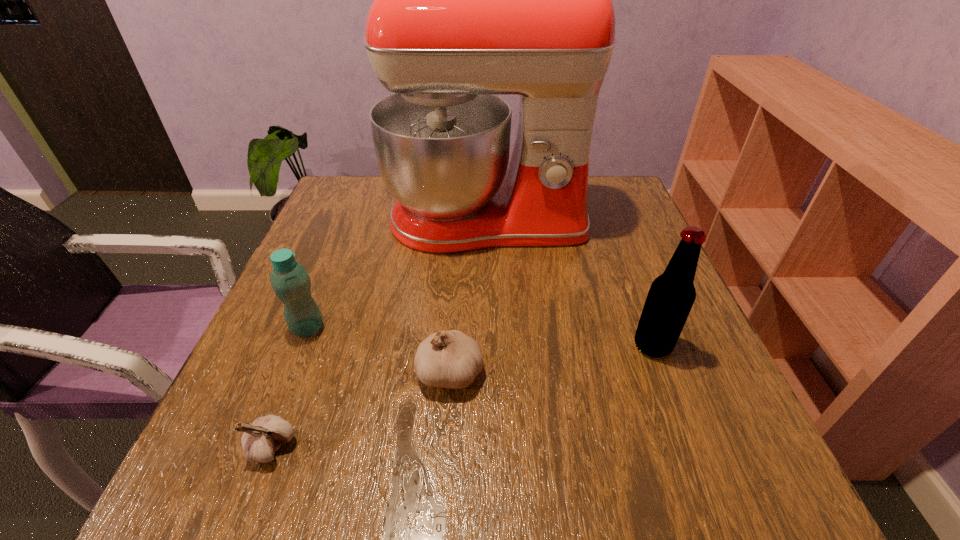
This screenshot has width=960, height=540. Find the location of `vacant space situated 0.190m on the front of the second tallest object`. vacant space situated 0.190m on the front of the second tallest object is located at coordinates (699, 468).

Image resolution: width=960 pixels, height=540 pixels. Identify the location of vacant space located at the front cap of the water bottle. (446, 328).

The image size is (960, 540). Find the location of `vacant space located on the back of the taller garlic`. vacant space located on the back of the taller garlic is located at coordinates (453, 322).

Find the location of `free space located 0.120m on the back of the nearer garlic`. free space located 0.120m on the back of the nearer garlic is located at coordinates (303, 363).

The image size is (960, 540). Identify the location of object that is at the far edge. (471, 0).

The height and width of the screenshot is (540, 960). Find the location of `object at the near edge`. object at the near edge is located at coordinates (260, 440).

In order to click on water bottle at the left edge in this screenshot , I will do `click(290, 281)`.

The height and width of the screenshot is (540, 960). Find the location of `garlic at the left edge`. garlic at the left edge is located at coordinates (260, 440).

Find the location of a particular element. This screenshot has height=540, width=960. mixer at the right edge is located at coordinates (471, 0).

I want to click on beer bottle at the right edge, so click(x=671, y=296).